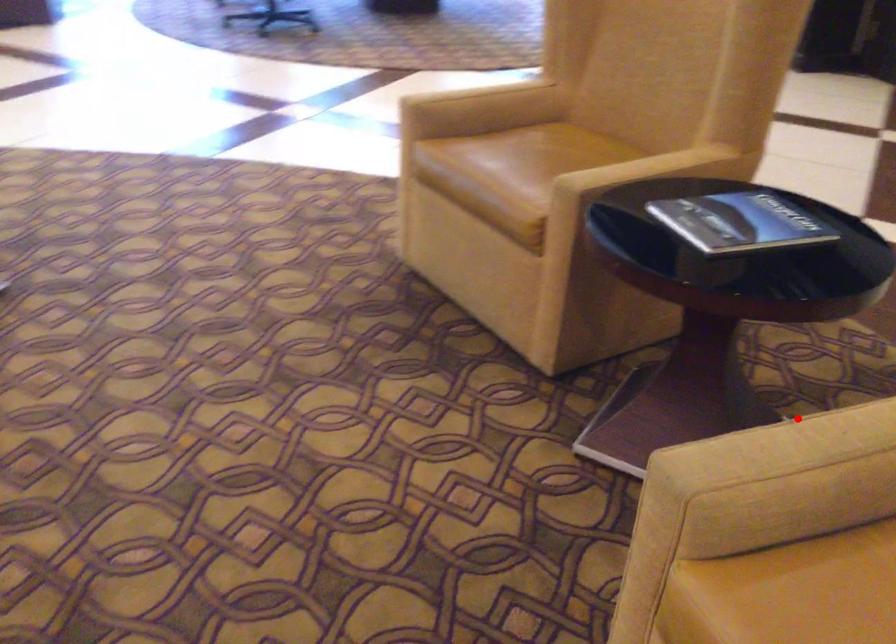
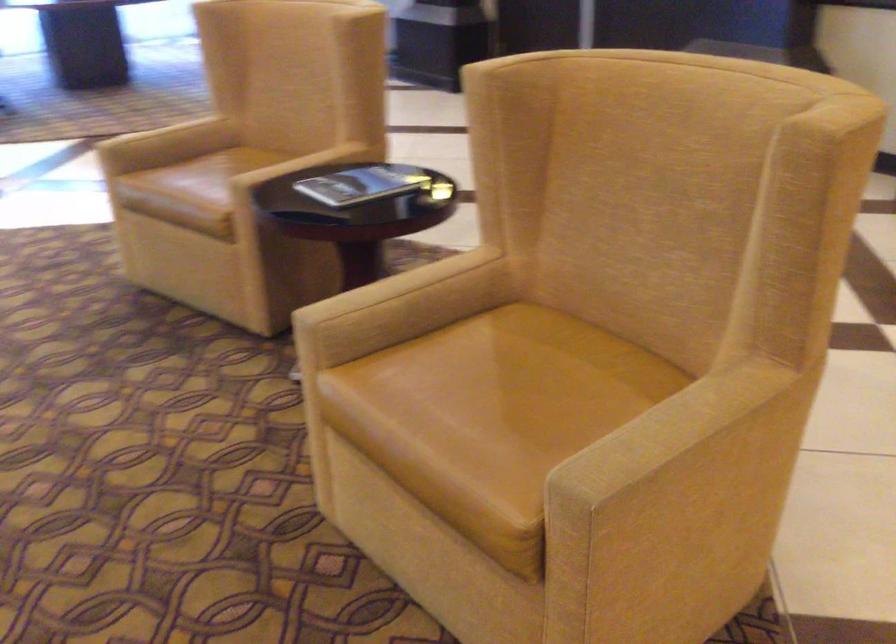
Question: A red point is marked in image1. In image2, is the corresponding 3D point closer to the camera or farther? Reply with the corresponding letter.

Choices:
 (A) The corresponding 3D point is closer.
 (B) The corresponding 3D point is farther.

Answer: (B)